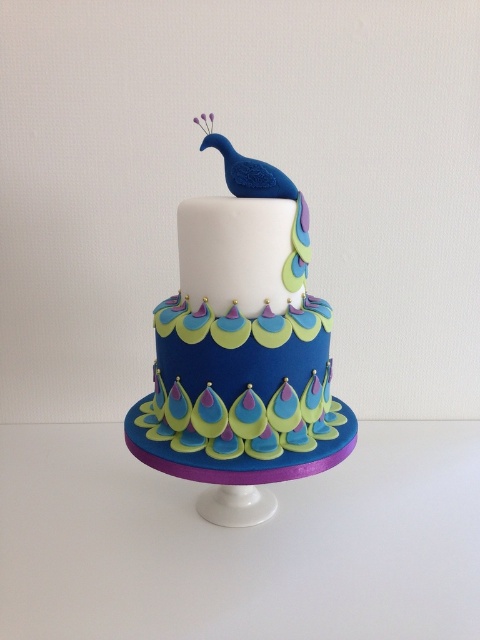
Question: Does matte blue peacock at center appear on the left side of white smooth cake at center?

Choices:
 (A) no
 (B) yes

Answer: (B)

Question: Which of the following is the closest to the observer?

Choices:
 (A) (210, 128)
 (B) (135, 448)

Answer: (B)

Question: Among these points, which one is farthest from the camera?

Choices:
 (A) (244, 268)
 (B) (196, 444)
 (C) (205, 122)

Answer: (C)

Question: Is matte blue peacock at center bigger than white smooth cake at center?

Choices:
 (A) no
 (B) yes

Answer: (B)

Question: Which is nearer to the blue glossy peacock at top?

Choices:
 (A) white smooth cake at center
 (B) matte blue peacock at center

Answer: (A)

Question: Does matte blue peacock at center appear over white smooth cake at center?

Choices:
 (A) yes
 (B) no

Answer: (B)